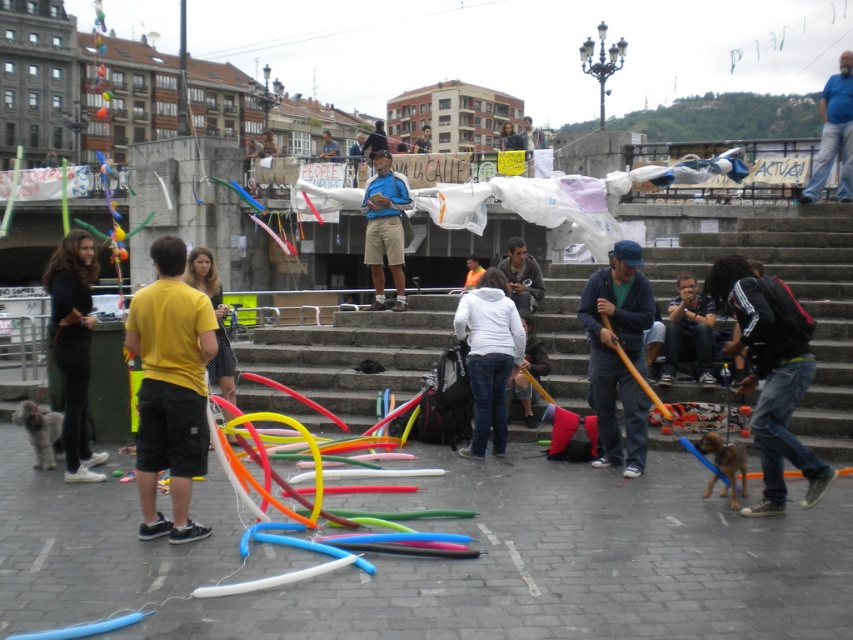
Question: Which is nearer to the matte blue jacket at center?

Choices:
 (A) black matte pants at left
 (B) matte blue shirt at center
 (C) blue denim jeans at center

Answer: (A)

Question: Is black matte pants at left wider than blue denim jeans at center?

Choices:
 (A) no
 (B) yes

Answer: (A)

Question: Does white matte hoodie at center lie behind blue denim jeans at center?

Choices:
 (A) no
 (B) yes

Answer: (A)

Question: Which point is farther from the camera taking this photo?

Choices:
 (A) (474, 432)
 (B) (83, 426)
 (C) (827, 104)
 (D) (596, 380)

Answer: (C)

Question: Where is black matte pants at left located in relation to blue denim jeans at center in the image?

Choices:
 (A) above
 (B) below

Answer: (B)

Question: Among these points, which one is nearest to the camera?

Choices:
 (A) (383, 211)
 (B) (619, 342)
 (C) (73, 280)
 (D) (489, 268)

Answer: (C)